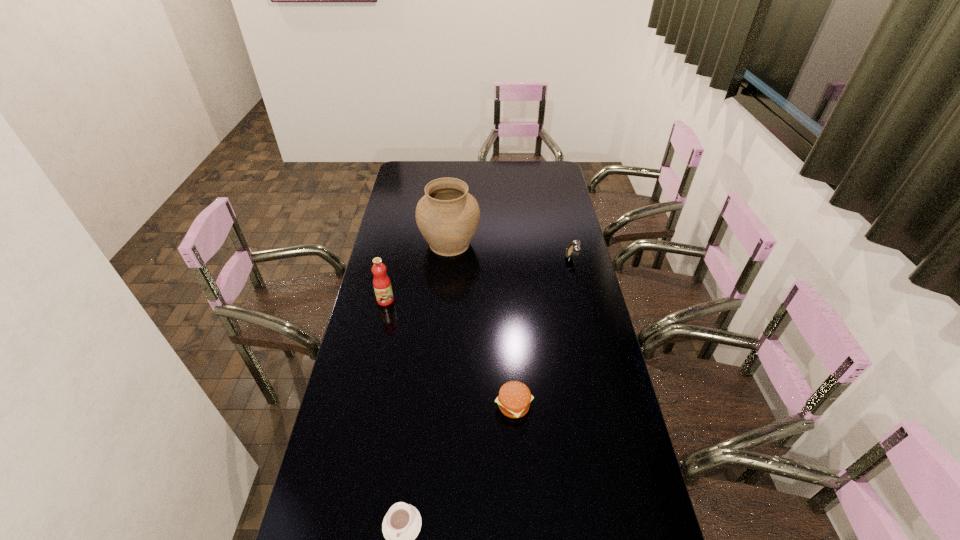
Locate an element on the screen. vacant area that lies between the second object from right to left and the third tallest object is located at coordinates (542, 332).

You are a GUI agent. You are given a task and a screenshot of the screen. Output one action in this format:
    pyautogui.click(x=<x>, y=<y>)
    Task: Click on the free spot between the leftmost object and the rightmost object
    Image resolution: width=960 pixels, height=540 pixels.
    Given the screenshot: What is the action you would take?
    pyautogui.click(x=478, y=279)

Identify the location of free space between the urn and the fourth object from left to right. The width and height of the screenshot is (960, 540). (482, 325).

Locate an element on the screen. The width and height of the screenshot is (960, 540). free point between the urn and the rightmost object is located at coordinates (511, 251).

I want to click on free space between the third farthest object and the third tallest object, so click(478, 279).

Image resolution: width=960 pixels, height=540 pixels. In order to click on the second closest object to the fourth object from left to right in this screenshot , I will do `click(382, 286)`.

You are a GUI agent. You are given a task and a screenshot of the screen. Output one action in this format:
    pyautogui.click(x=<x>, y=<y>)
    Task: Click on the object that stands as the second closest to the nearest object
    
    Given the screenshot: What is the action you would take?
    pyautogui.click(x=382, y=286)

This screenshot has height=540, width=960. In order to click on free space that satisfies the following two spatial constraints: 1. on the front label of the fourth tallest object; 2. on the right side of the third farthest object in this screenshot , I will do `click(363, 406)`.

Where is `free space that satisfies the following two spatial constraints: 1. on the front side of the tallest object; 2. on the right side of the fourth tallest object`? The height and width of the screenshot is (540, 960). free space that satisfies the following two spatial constraints: 1. on the front side of the tallest object; 2. on the right side of the fourth tallest object is located at coordinates (437, 406).

You are a GUI agent. You are given a task and a screenshot of the screen. Output one action in this format:
    pyautogui.click(x=<x>, y=<y>)
    Task: Click on the free location that satisfies the following two spatial constraints: 1. on the face of the rightmost object; 2. on the front label of the third nearest object
    Image resolution: width=960 pixels, height=540 pixels.
    Given the screenshot: What is the action you would take?
    pyautogui.click(x=582, y=300)